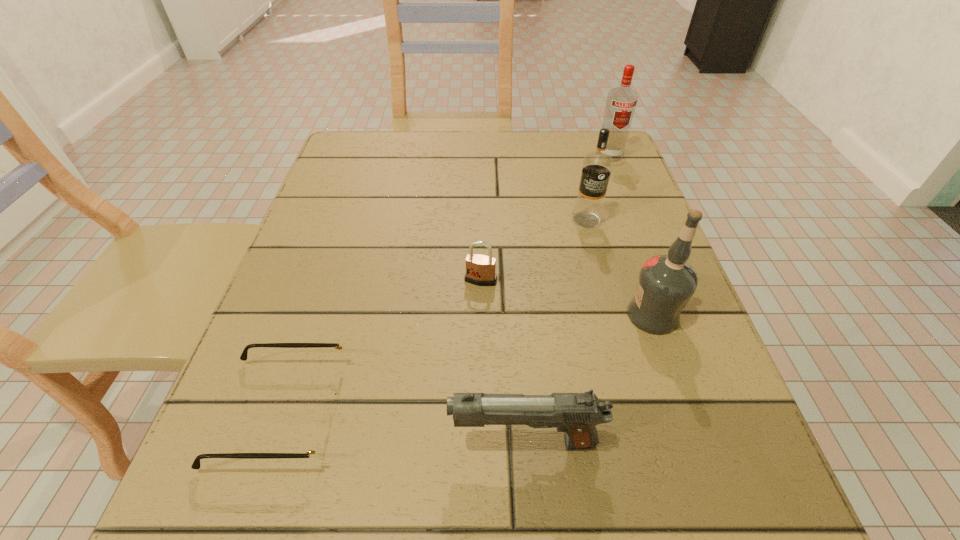
Where is `the farthest vodka`? The height and width of the screenshot is (540, 960). the farthest vodka is located at coordinates (621, 103).

The image size is (960, 540). Find the location of `the nearest vodka`. the nearest vodka is located at coordinates (666, 283).

Locate an element on the screen. The height and width of the screenshot is (540, 960). the second nearest vodka is located at coordinates (597, 166).

I want to click on gun, so click(x=577, y=414).

Find the location of `the fourth nearest object`. the fourth nearest object is located at coordinates (480, 269).

Identify the location of padlock. This screenshot has width=960, height=540. (480, 269).

I want to click on the shortest object, so click(317, 452).

In order to click on the leftmost object in this screenshot , I will do `click(317, 452)`.

Locate an element on the screen. Image resolution: width=960 pixels, height=540 pixels. free space located on the front label of the farthest object is located at coordinates (623, 192).

This screenshot has width=960, height=540. In order to click on vacant space situated on the front label of the nearest vodka in this screenshot , I will do `click(403, 315)`.